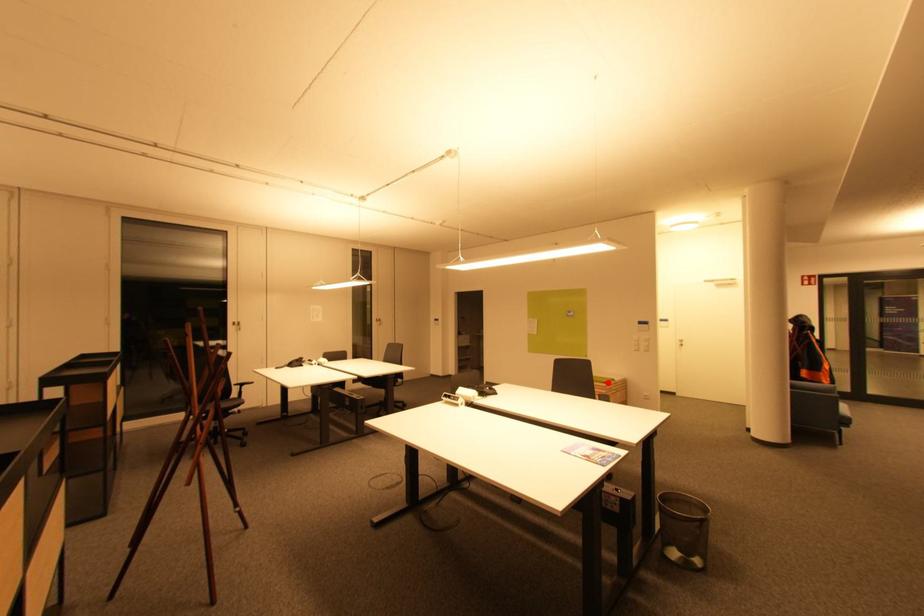
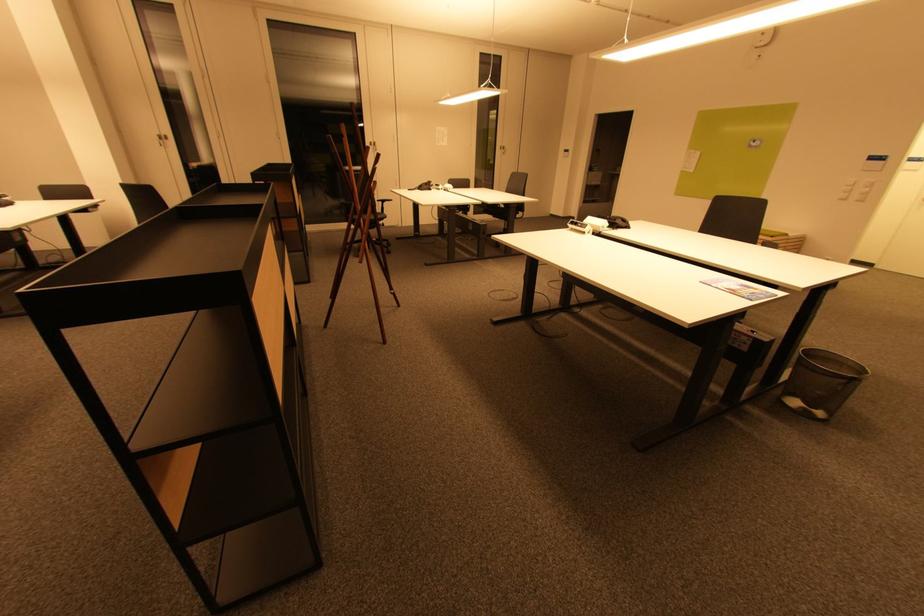
Question: I am providing you with two images of the same scene from different viewpoints. A red point is shown in image1. For the corresponding object point in image2, is it positioned nearer or farther from the camera?

Choices:
 (A) Nearer
 (B) Farther

Answer: (A)